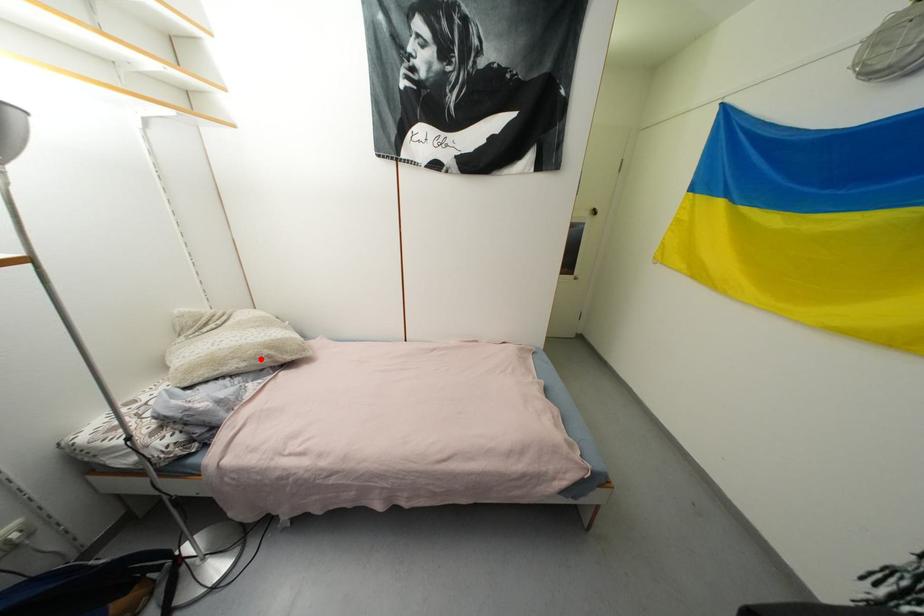
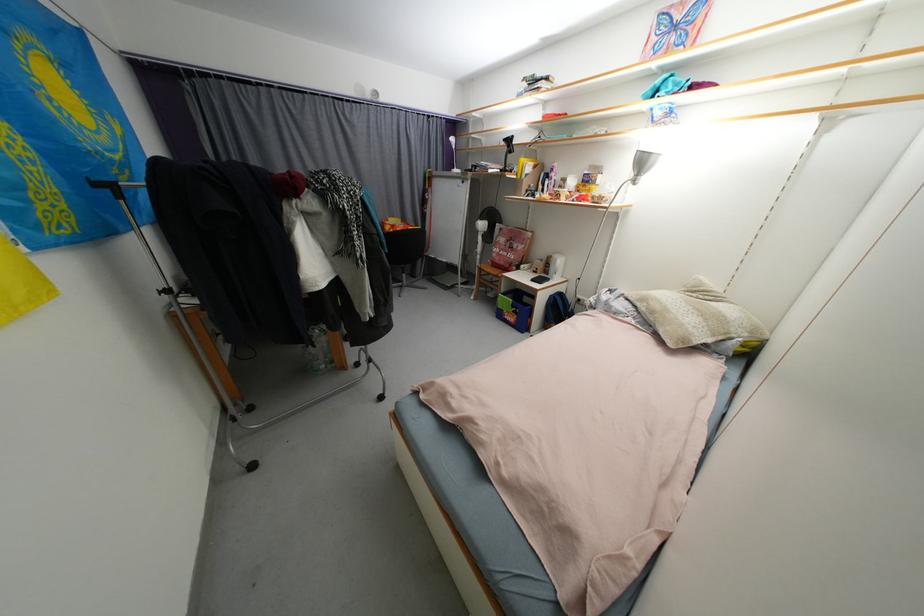
Find the pixel in the second image that matches the highlighted location in the first image.

(658, 314)